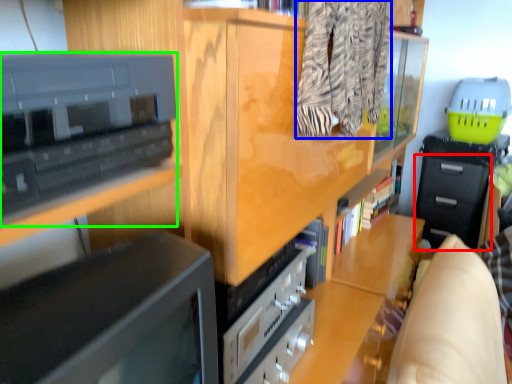
Question: Based on their relative distances, which object is nearer to drawer (highlighted by a red box)? Choose from clothing (highlighted by a blue box) and cabinetry (highlighted by a green box).

Choices:
 (A) clothing
 (B) cabinetry

Answer: (A)